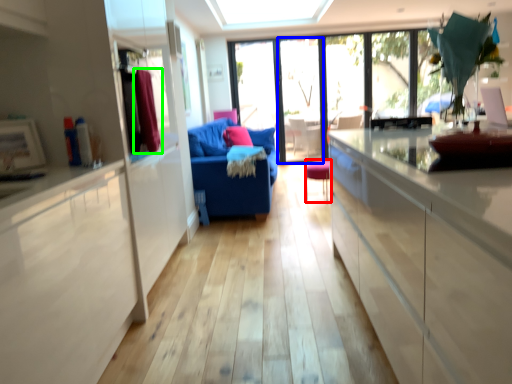
Question: Considering the real-world distances, which object is closest to chair (highlighted by a red box)? screen door (highlighted by a blue box) or curtain (highlighted by a green box).

Choices:
 (A) screen door
 (B) curtain

Answer: (A)